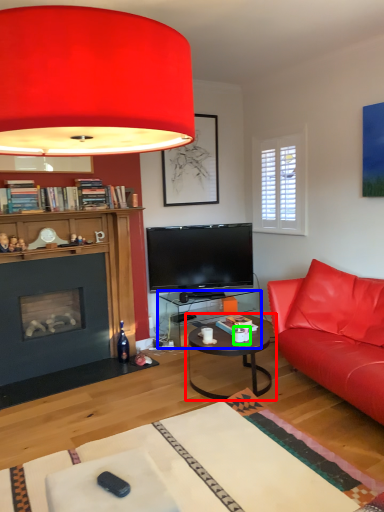
Question: Which is farther away from coffee table (highlighted by a red box)? desk (highlighted by a blue box) or coffee cup (highlighted by a green box)?

Choices:
 (A) desk
 (B) coffee cup

Answer: (A)